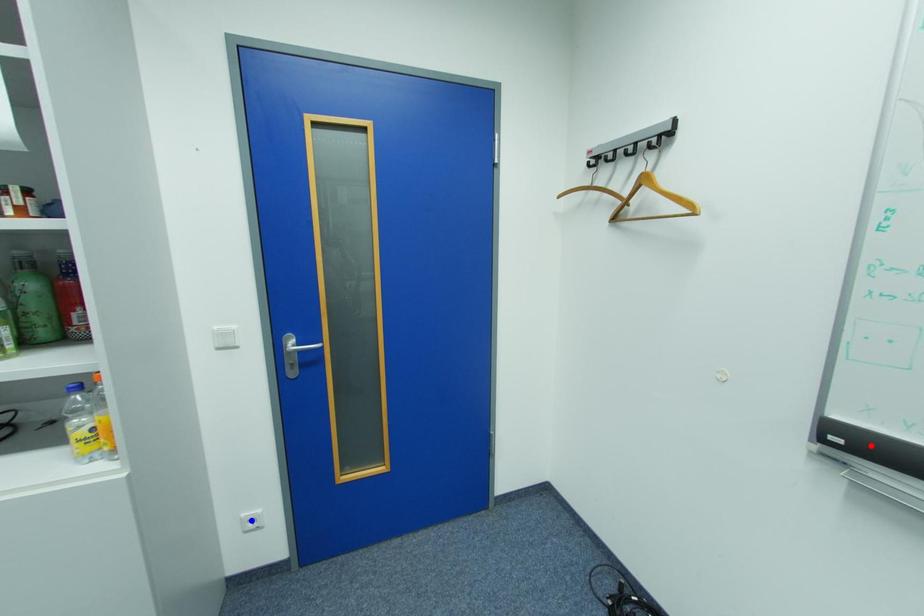
Question: Two points are marked on the image. Which point is closer to the camera?

Choices:
 (A) Blue point is closer.
 (B) Red point is closer.

Answer: (B)